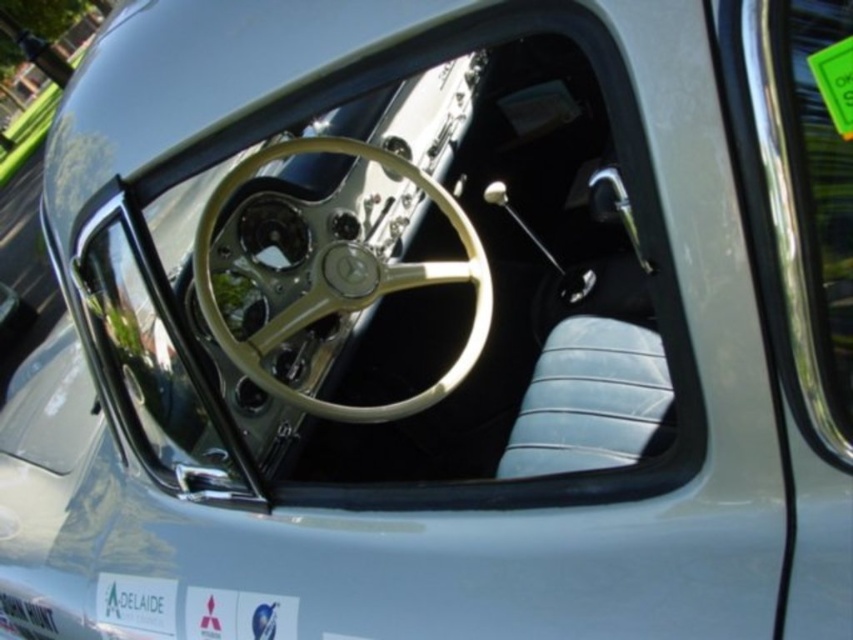
Can you confirm if polished chrome window at right is thinner than white plastic license plate at lower left?

Yes.

Does polished chrome window at right appear under white plastic license plate at lower left?

Incorrect, polished chrome window at right is not positioned below white plastic license plate at lower left.

Is point (801, 314) farther from camera compared to point (25, 625)?

No, it is in front of (25, 625).

In order to click on polished chrome window at right in this screenshot , I will do [786, 224].

Is point (287, 337) less distant than point (753, 74)?

No, (287, 337) is further to viewer.

Who is more distant from viewer, (219, 326) or (776, 97)?

Point (219, 326)

Which is behind, point (209, 294) or point (787, 196)?

The point (209, 294) is more distant.

Locate an element on the screen. gold metallic steering wheel at center is located at coordinates click(x=344, y=284).

Is gold metallic steering wheel at center smaller than white plastic license plate at lower left?

No, gold metallic steering wheel at center is not smaller than white plastic license plate at lower left.

In order to click on gold metallic steering wheel at center in this screenshot , I will do `click(344, 284)`.